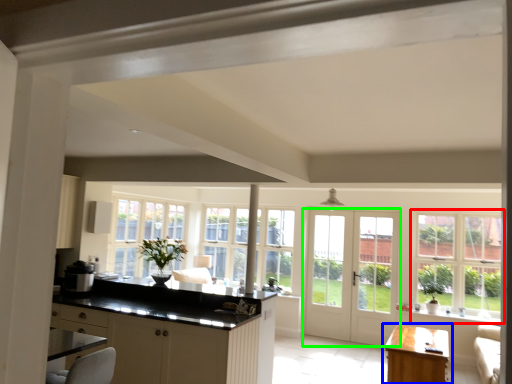
Question: Considering the real-world distances, which object is farthest from window (highlighted by a red box)? table (highlighted by a blue box) or door (highlighted by a green box)?

Choices:
 (A) table
 (B) door

Answer: (A)